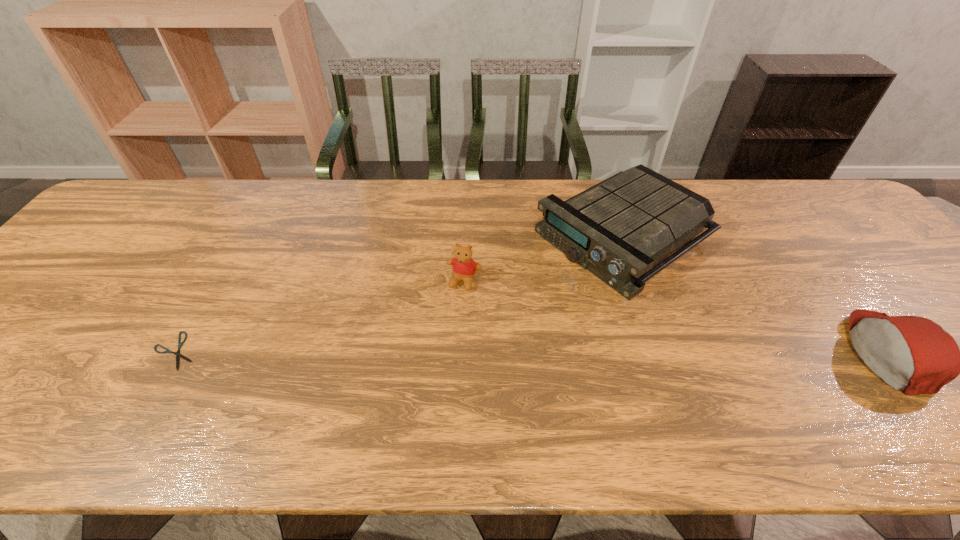
Image resolution: width=960 pixels, height=540 pixels. I want to click on vacant space on the desktop that is between the shears and the cap and is positioned on the front panel of the radio receiver, so point(436,352).

The width and height of the screenshot is (960, 540). What are the coordinates of `free space on the desktop that is between the leftmost object and the cap and is positioned on the front-facing side of the second object from left to right` in the screenshot? It's located at (438, 352).